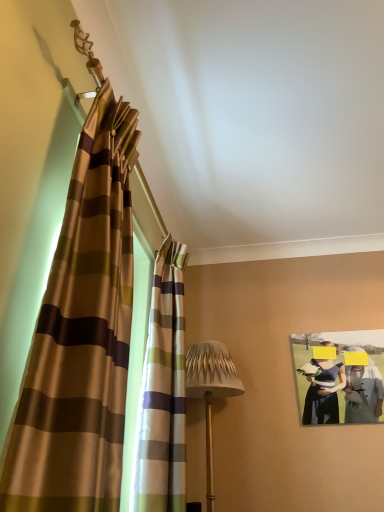
Question: Could textured beige lampshade at center be considered to be inside matte paper photo frame at upper right?

Choices:
 (A) yes
 (B) no

Answer: (B)

Question: From the image's perspective, is matte paper photo frame at upper right below textured beige lampshade at center?

Choices:
 (A) no
 (B) yes

Answer: (A)

Question: Is matte paper photo frame at upper right further to camera compared to textured beige lampshade at center?

Choices:
 (A) yes
 (B) no

Answer: (A)

Question: Is matte paper photo frame at upper right smaller than textured beige lampshade at center?

Choices:
 (A) no
 (B) yes

Answer: (B)

Question: Could you tell me if matte paper photo frame at upper right is turned towards textured beige lampshade at center?

Choices:
 (A) yes
 (B) no

Answer: (B)

Question: Considering the relative sizes of matte paper photo frame at upper right and textured beige lampshade at center in the image provided, is matte paper photo frame at upper right thinner than textured beige lampshade at center?

Choices:
 (A) no
 (B) yes

Answer: (B)

Question: From a real-world perspective, is textured beige lampshade at center located beneath striped fabric curtain at left, which is the 2th curtain in front-to-back order?

Choices:
 (A) yes
 (B) no

Answer: (A)

Question: Considering the relative sizes of textured beige lampshade at center and striped fabric curtain at left, which is the 2th curtain in front-to-back order, in the image provided, is textured beige lampshade at center bigger than striped fabric curtain at left, which is the 2th curtain in front-to-back order,?

Choices:
 (A) yes
 (B) no

Answer: (A)

Question: Is the position of textured beige lampshade at center more distant than that of striped fabric curtain at left, which is the first curtain from back to front?

Choices:
 (A) no
 (B) yes

Answer: (B)

Question: From the image's perspective, is textured beige lampshade at center beneath striped fabric curtain at left, which is the first curtain from back to front?

Choices:
 (A) no
 (B) yes

Answer: (B)

Question: Is textured beige lampshade at center at the left side of striped fabric curtain at left, which is the first curtain from back to front?

Choices:
 (A) no
 (B) yes

Answer: (A)

Question: Does textured beige lampshade at center have a lesser width compared to striped fabric curtain at left, which is the 2th curtain in front-to-back order?

Choices:
 (A) yes
 (B) no

Answer: (B)

Question: From a real-world perspective, is textured beige lampshade at center below matte paper photo frame at upper right?

Choices:
 (A) yes
 (B) no

Answer: (A)